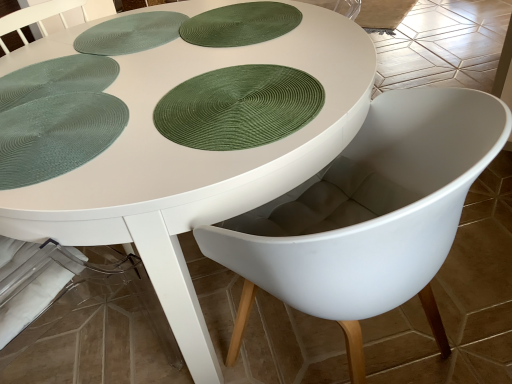
The width and height of the screenshot is (512, 384). I want to click on vacant area on the back side of green textured placemat at left, marked as the first paper plate in a bottom-to-top arrangement, so click(106, 69).